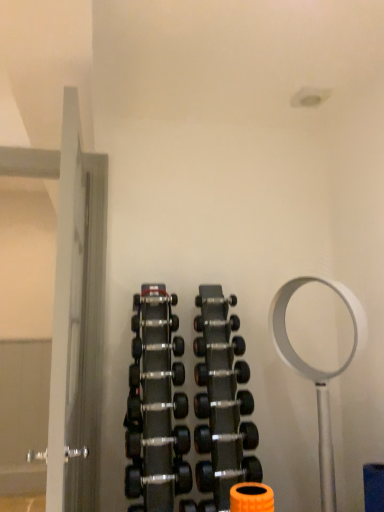
Question: In which direction should I rotate to look at black rubber dumbbell at center, the tenth dumbbell positioned from the bottom?

Choices:
 (A) left
 (B) right

Answer: (A)

Question: Can you confirm if black rubber dumbbell at center, which is the fifth dumbbell in top-to-bottom order, is shorter than black rubber dumbbell at center, the 1th dumbbell ordered from the bottom?

Choices:
 (A) no
 (B) yes

Answer: (B)

Question: From a real-world perspective, is black rubber dumbbell at center, which is the fifth dumbbell in top-to-bottom order, located higher than black rubber dumbbell at center, the 11th dumbbell positioned from the top?

Choices:
 (A) yes
 (B) no

Answer: (A)

Question: Is black rubber dumbbell at center, marked as the 7th dumbbell in a bottom-to-top arrangement, positioned behind black rubber dumbbell at center, the 1th dumbbell ordered from the bottom?

Choices:
 (A) yes
 (B) no

Answer: (A)

Question: From the image's perspective, is black rubber dumbbell at center, which is the fifth dumbbell in top-to-bottom order, under black rubber dumbbell at center, the 11th dumbbell positioned from the top?

Choices:
 (A) yes
 (B) no

Answer: (B)

Question: Are black rubber dumbbell at center, which is the fifth dumbbell in top-to-bottom order, and black rubber dumbbell at center, the 1th dumbbell ordered from the bottom, located far from each other?

Choices:
 (A) no
 (B) yes

Answer: (A)

Question: From a real-world perspective, is black rubber dumbbell at center, which is the fifth dumbbell in top-to-bottom order, located beneath black rubber dumbbell at center, the 1th dumbbell ordered from the bottom?

Choices:
 (A) yes
 (B) no

Answer: (B)

Question: Is the depth of black rubber dumbbell at center, which is the sixth dumbbell in top-to-bottom order, greater than that of black rubber dumbbell at center, arranged as the 7th dumbbell when viewed from the top?

Choices:
 (A) no
 (B) yes

Answer: (A)

Question: Is black rubber dumbbell at center, which is the sixth dumbbell in top-to-bottom order, looking in the opposite direction of black rubber dumbbell at center, arranged as the 7th dumbbell when viewed from the top?

Choices:
 (A) no
 (B) yes

Answer: (A)

Question: Can you confirm if black rubber dumbbell at center, which is the sixth dumbbell in top-to-bottom order, is thinner than black rubber dumbbell at center, acting as the 5th dumbbell starting from the bottom?

Choices:
 (A) no
 (B) yes

Answer: (B)

Question: Would you say black rubber dumbbell at center, arranged as the 7th dumbbell when viewed from the top, is part of black rubber dumbbell at center, which is the sixth dumbbell in top-to-bottom order,'s contents?

Choices:
 (A) no
 (B) yes

Answer: (A)

Question: Is black rubber dumbbell at center, marked as the sixth dumbbell in a bottom-to-top arrangement, to the left of black rubber dumbbell at center, acting as the 5th dumbbell starting from the bottom, from the viewer's perspective?

Choices:
 (A) yes
 (B) no

Answer: (A)

Question: Is black rubber dumbbell at center, which is the sixth dumbbell in top-to-bottom order, oriented towards black rubber dumbbell at center, acting as the 5th dumbbell starting from the bottom?

Choices:
 (A) no
 (B) yes

Answer: (A)

Question: Can black rubber dumbbell at center, which is the sixth dumbbell in top-to-bottom order, be found inside black rubber dumbbell at center, the third dumbbell when ordered from bottom to top?

Choices:
 (A) no
 (B) yes

Answer: (A)